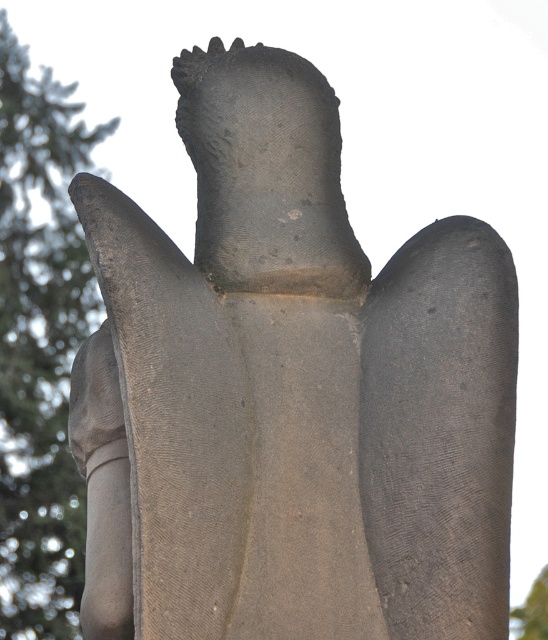
Does green textured tree at left appear under green leafy tree at upper left?

Actually, green textured tree at left is above green leafy tree at upper left.

Does green textured tree at left have a lesser width compared to green leafy tree at upper left?

Incorrect, green textured tree at left's width is not less than green leafy tree at upper left's.

Is point (42, 384) farther from viewer compared to point (523, 627)?

No.

Find the location of a particular element. The height and width of the screenshot is (640, 548). green textured tree at left is located at coordinates (39, 344).

Based on the photo, can you confirm if matte gray hand at left is taller than green leafy tree at upper left?

Indeed, matte gray hand at left has a greater height compared to green leafy tree at upper left.

Describe the element at coordinates (94, 396) in the screenshot. This screenshot has width=548, height=640. I see `matte gray hand at left` at that location.

I want to click on matte gray hand at left, so click(94, 396).

Is point (14, 54) positioned after point (72, 428)?

Yes, point (14, 54) is farther from viewer.

The image size is (548, 640). Describe the element at coordinates (39, 344) in the screenshot. I see `green textured tree at left` at that location.

Describe the element at coordinates (39, 344) in the screenshot. I see `green textured tree at left` at that location.

Locate an element on the screen. This screenshot has width=548, height=640. green textured tree at left is located at coordinates (39, 344).